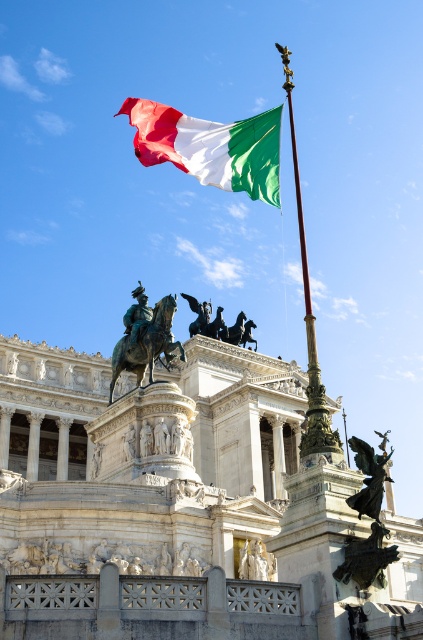
Question: Which point is farther to the camera?

Choices:
 (A) (381, 470)
 (B) (241, 576)

Answer: (B)

Question: Does tri-color fabric flag at upper center appear under matte white statue at lower center?

Choices:
 (A) no
 (B) yes

Answer: (A)

Question: Can you confirm if bronze statue at lower right is bigger than matte white statue at lower center?

Choices:
 (A) no
 (B) yes

Answer: (A)

Question: Estimate the real-world distances between objects in this image. Which object is farther from the white marble palace at center?

Choices:
 (A) bronze statue at lower right
 (B) matte white statue at lower center

Answer: (A)

Question: Estimate the real-world distances between objects in this image. Which object is closer to the bronze statue at lower right?

Choices:
 (A) polished bronze statue at lower right
 (B) matte white statue at lower center
 (C) shiny bronze horse at upper center

Answer: (A)

Question: Can you confirm if shiny bronze horse at upper center is positioned above bronze statue at lower right?

Choices:
 (A) yes
 (B) no

Answer: (A)